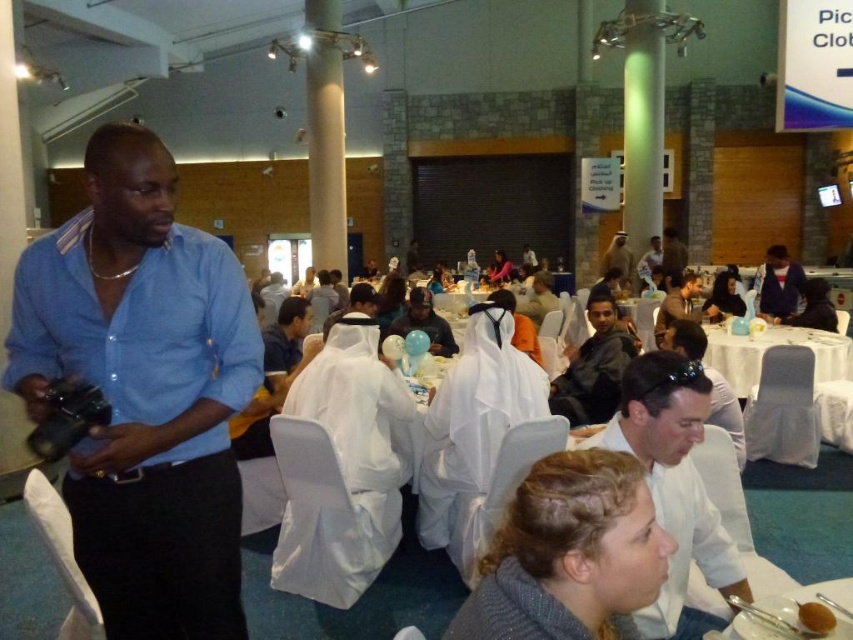
You are standing at the entrance of the hall and see the blue cotton shirt at left and the dark gray fabric jacket at center. Which one is taller?

The blue cotton shirt at left is much taller than the dark gray fabric jacket at center.

You are standing at the entrance of the hall and notice two items in the scene. The first is the white glossy shirt at lower right and the second is the light brown leather jacket at center. Which of these two items is positioned higher up in the image?

The white glossy shirt at lower right is taller than the light brown leather jacket at center, so the white glossy shirt at lower right is positioned higher up in the image.

You are at the event and want to retrieve the brown matte cup at lower right. Is the light brown leather jacket at center blocking your direct path to it?

The light brown leather jacket at center is positioned over the brown matte cup at lower right, so yes, the jacket is blocking the direct path to the cup.